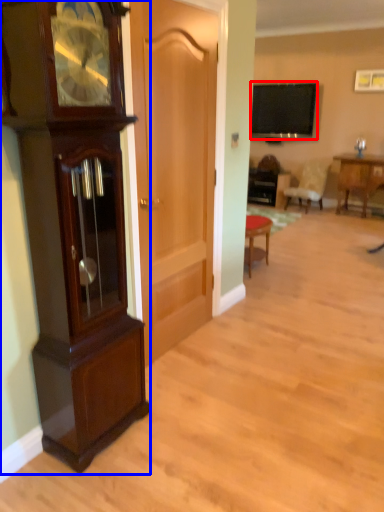
Question: Which object appears farthest to the camera in this image, television (highlighted by a red box) or cabinetry (highlighted by a blue box)?

Choices:
 (A) television
 (B) cabinetry

Answer: (A)